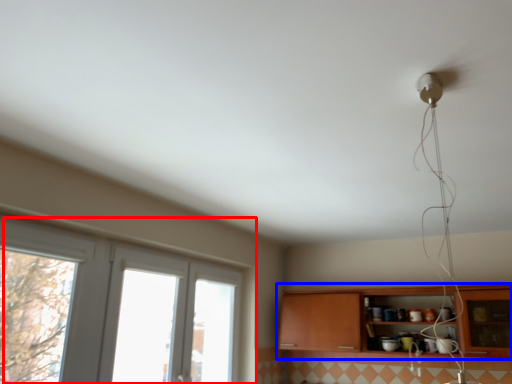
Question: Which object appears closest to the camera in this image, window (highlighted by a red box) or cabinetry (highlighted by a blue box)?

Choices:
 (A) window
 (B) cabinetry

Answer: (A)